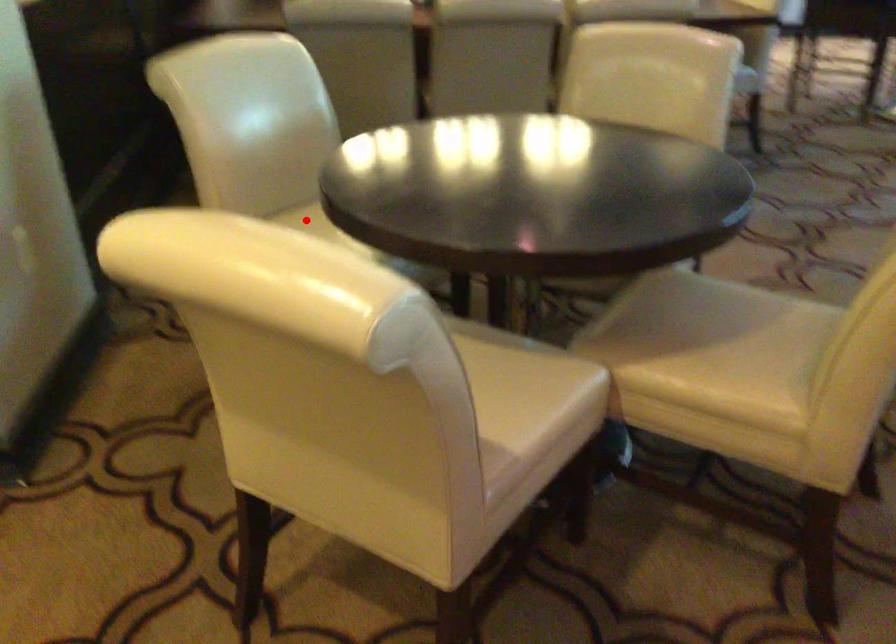
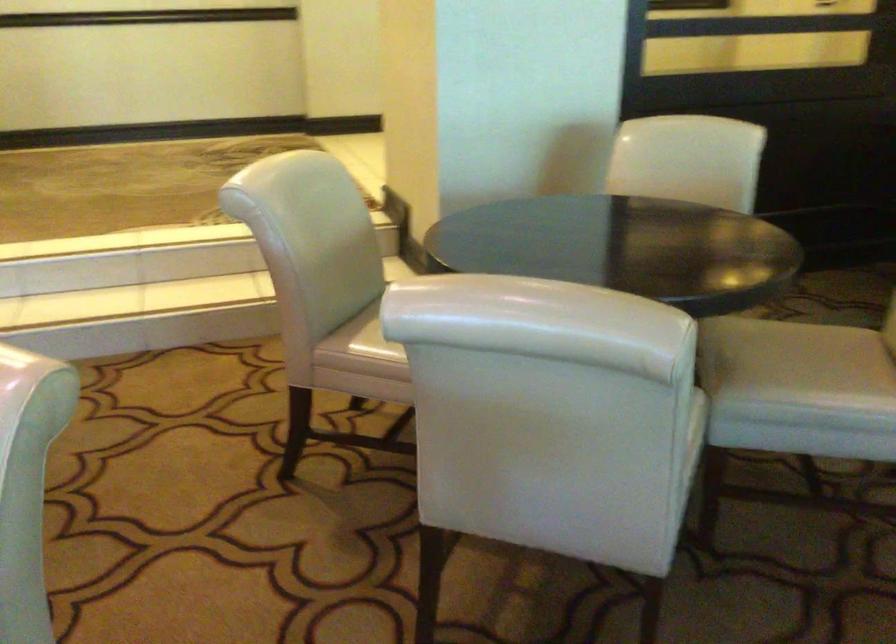
Question: I am providing you with two images of the same scene from different viewpoints. A red point is marked on the first image. Can you still see the location of the red point in image 2?

Choices:
 (A) Yes
 (B) No

Answer: (B)